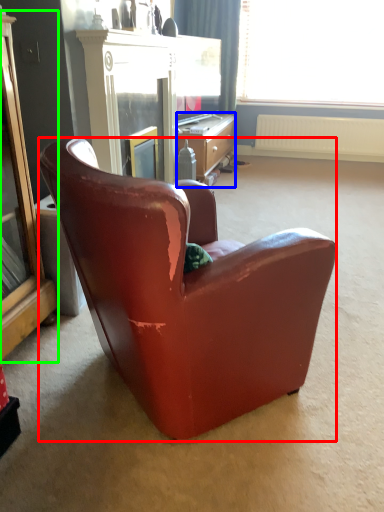
Question: Estimate the real-world distances between objects in this image. Which object is farther from chair (highlighted by a red box), desk (highlighted by a blue box) or cabinetry (highlighted by a green box)?

Choices:
 (A) desk
 (B) cabinetry

Answer: (A)